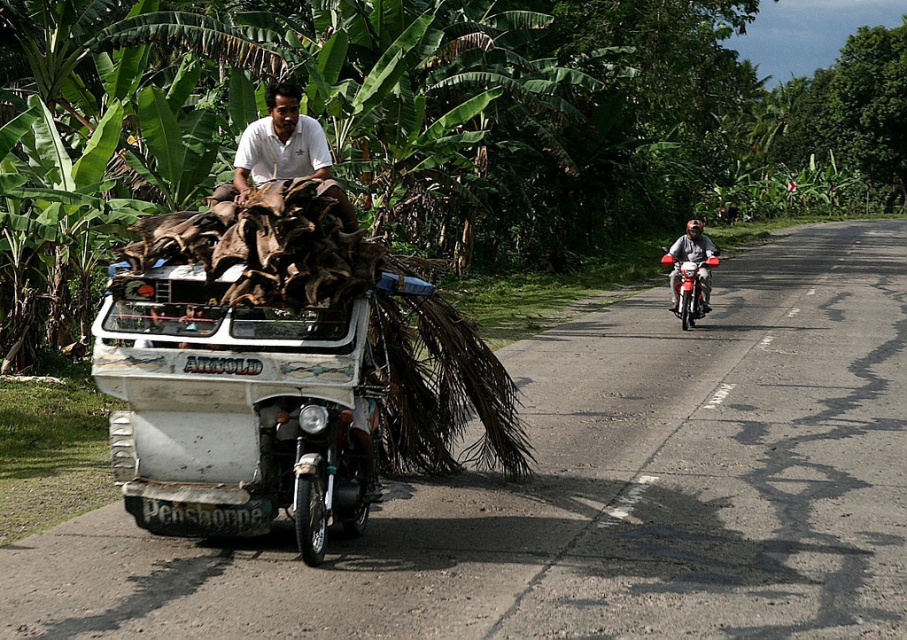
You are a pedestrian standing at the center of the road. You see a white painted wood tricycle at center and a red glossy motorcycle at right. Which vehicle is closer to your right side?

The red glossy motorcycle at right is closer to your right side because it is positioned to the right of the white painted wood tricycle at center.

You are a delivery person who needs to choose a vehicle to carry a large package. The white painted wood tricycle at center can carry heavier loads than the red glossy motorcycle at right. Which vehicle should you choose?

The white painted wood tricycle at center is bigger than the red glossy motorcycle at right, so you should choose the white painted wood tricycle at center because it can carry heavier loads.

Based on the scene description, can you determine the exact 2D coordinates of the white painted wood tricycle at center?

The white painted wood tricycle at center is located at the 2D coordinates of point (236, 408).